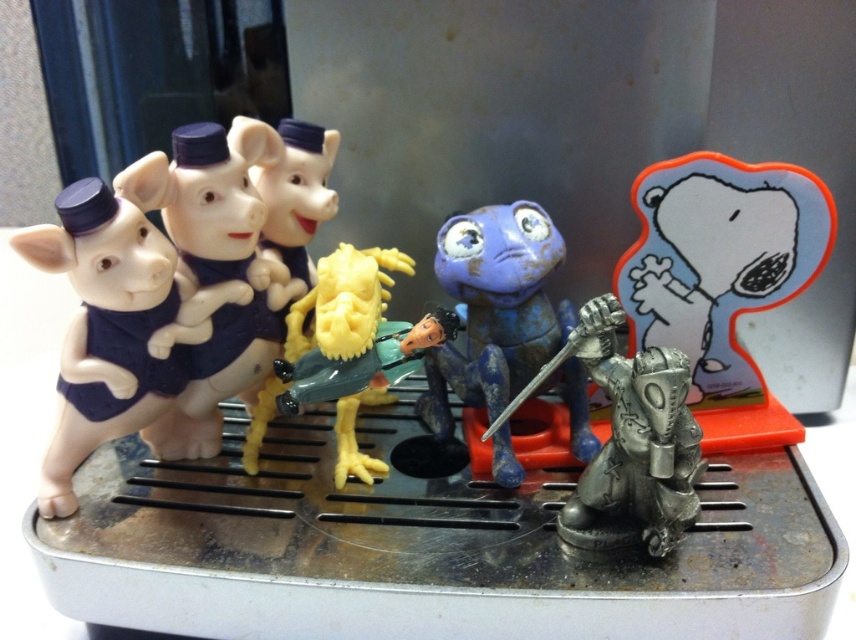
Question: Is matte black piglets at left bigger than matte plastic pigs at left?

Choices:
 (A) no
 (B) yes

Answer: (A)

Question: Is the position of matte plastic pigs at left more distant than that of antique silver sword at center?

Choices:
 (A) no
 (B) yes

Answer: (B)

Question: Which of the following is the farthest from the observer?

Choices:
 (A) (189, 273)
 (B) (681, 371)
 (C) (170, 282)
 (D) (492, 296)

Answer: (D)

Question: In this image, where is matte black piglets at left located relative to matte plastic pigs at left?

Choices:
 (A) right
 (B) left

Answer: (B)

Question: Which point is closer to the camera taking this photo?

Choices:
 (A) (x=110, y=301)
 (B) (x=569, y=301)

Answer: (A)

Question: Which of the following is the closest to the observer?

Choices:
 (A) (92, 316)
 (B) (530, 314)
 (C) (648, 476)
 (D) (268, 138)

Answer: (C)